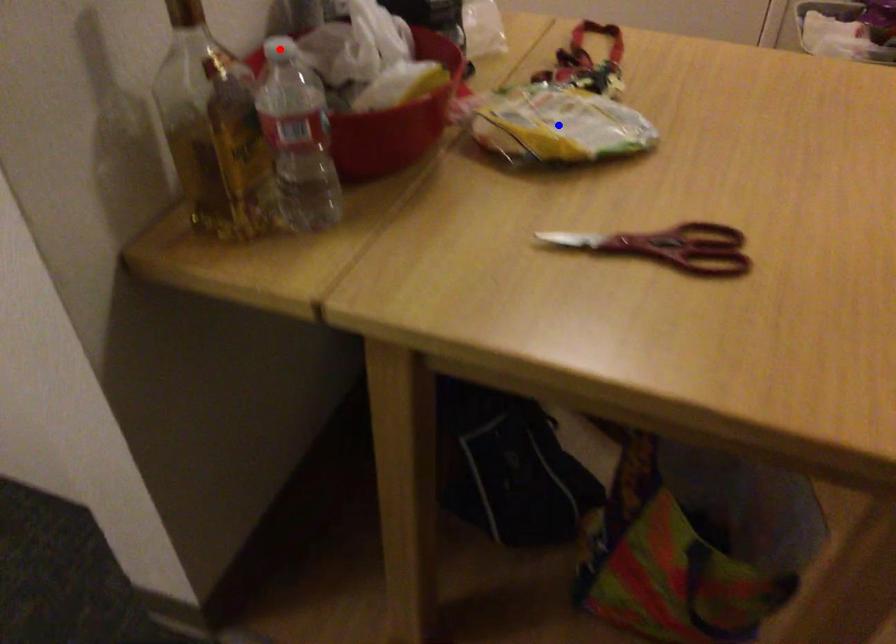
Question: Two points are marked on the image. Which point is closer to the camera?

Choices:
 (A) Blue point is closer.
 (B) Red point is closer.

Answer: (B)